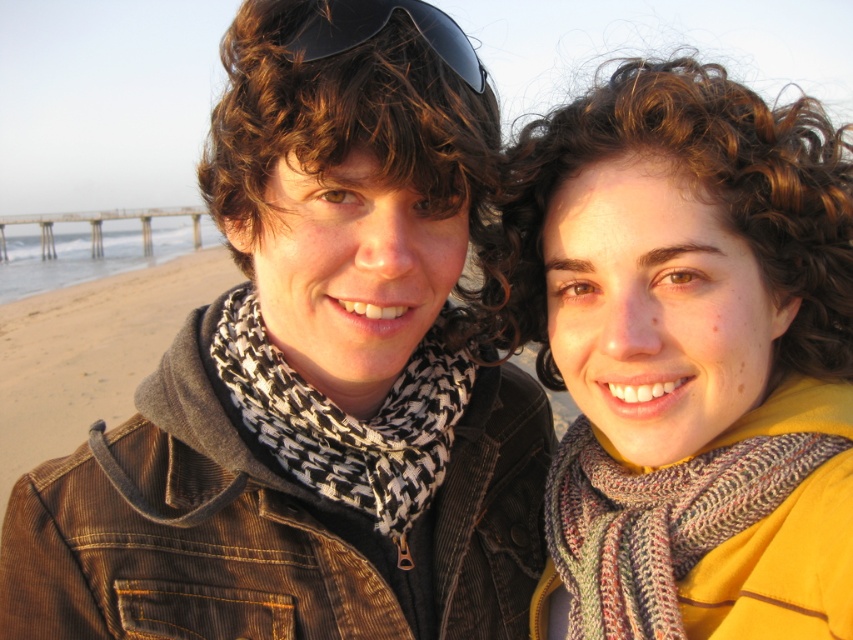
You are a photographer trying to capture a photo of the two people on the beach. You want to ensure that both the knitted scarf at center and the knitted multicolored scarf at right are clearly visible in the frame. Based on their positions, which scarf is higher up in the image?

The knitted scarf at center is higher up in the image because it is positioned above the knitted multicolored scarf at right.

You are a photographer trying to capture a closeup shot of the knitted scarf at center and the knitted multicolored scarf at right. Since you want to emphasize the texture of the scarves, which one should you focus on to ensure the texture is clearly visible?

The knitted scarf at center has a greater height compared to the knitted multicolored scarf at right, so focusing on the knitted scarf at center will allow for clearer texture visibility due to its larger size.

You are a photographer trying to capture a candid shot of the two people on the beach. You notice the black matte sunglasses at upper center and the knitted multicolored scarf at right. Which object should you focus on if you want to capture the person on the right?

The knitted multicolored scarf at right is worn by the person on the right, so focusing on it would help capture their image.